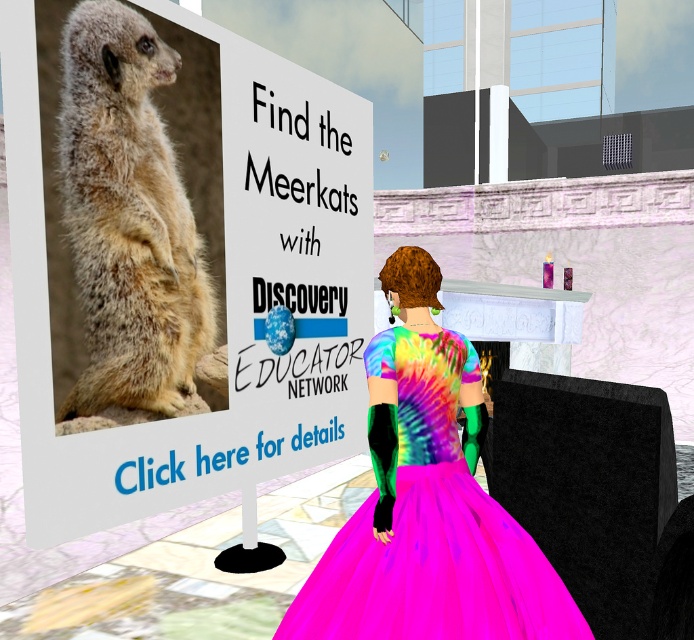
Question: Is light brown fur meerkat at center to the left of neon pink taffeta dress at center from the viewer's perspective?

Choices:
 (A) no
 (B) yes

Answer: (B)

Question: Which of the following is the closest to the observer?

Choices:
 (A) neon pink taffeta dress at center
 (B) natural fur meerkat at upper left
 (C) light brown fur meerkat at center

Answer: (A)

Question: Does light brown fur meerkat at center have a smaller size compared to neon pink taffeta dress at center?

Choices:
 (A) no
 (B) yes

Answer: (A)

Question: Among these objects, which one is nearest to the camera?

Choices:
 (A) light brown fur meerkat at center
 (B) neon pink taffeta dress at center
 (C) natural fur meerkat at upper left

Answer: (B)

Question: Which object is the closest to the neon pink taffeta dress at center?

Choices:
 (A) light brown fur meerkat at center
 (B) natural fur meerkat at upper left

Answer: (A)

Question: Can you confirm if light brown fur meerkat at center is thinner than neon pink taffeta dress at center?

Choices:
 (A) no
 (B) yes

Answer: (B)